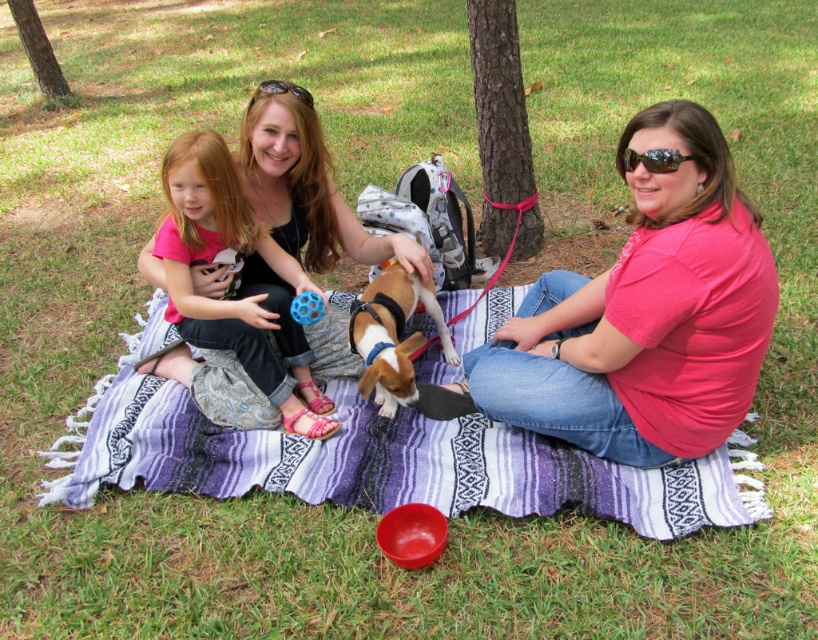
Question: Is brown rough tree trunk at upper left further to the viewer compared to shiny black sunglasses at upper right?

Choices:
 (A) yes
 (B) no

Answer: (A)

Question: Which object appears farthest from the camera in this image?

Choices:
 (A) brown rough bark tree at center
 (B) purple woven blanket at center
 (C) pink matte shirt at center

Answer: (A)

Question: Which of the following is the farthest from the observer?

Choices:
 (A) (240, 310)
 (B) (641, 140)

Answer: (A)

Question: Can you confirm if pink fabric at center is bigger than black rubber sunglasses at center?

Choices:
 (A) no
 (B) yes

Answer: (B)

Question: Can you confirm if pink fabric at center is positioned below brown rough tree trunk at upper left?

Choices:
 (A) yes
 (B) no

Answer: (A)

Question: Which of the following is the closest to the observer?

Choices:
 (A) purple woven blanket at center
 (B) brown and white fur at center
 (C) shiny black sunglasses at upper right
 (D) pink matte shirt at center

Answer: (D)